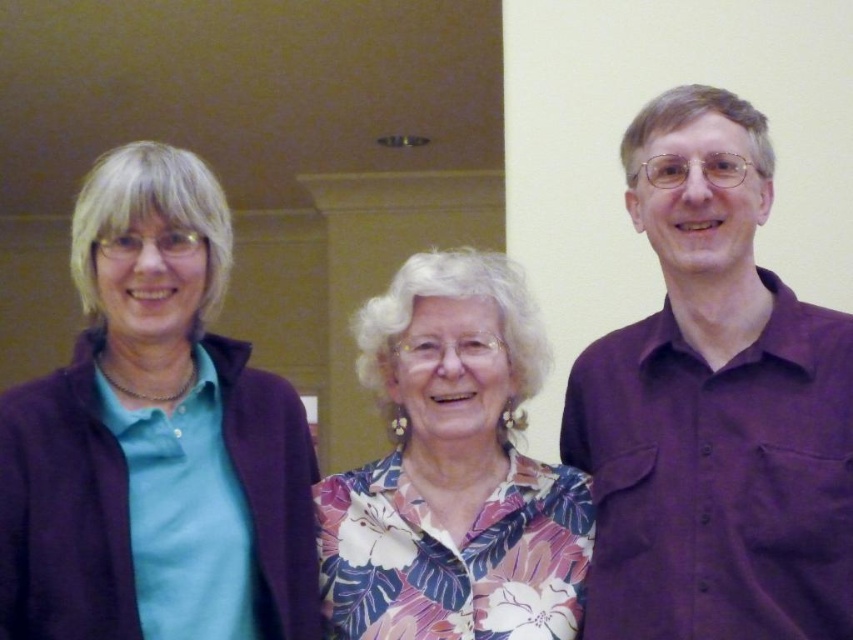
Question: Estimate the real-world distances between objects in this image. Which object is farther from the matte purple jacket at left?

Choices:
 (A) floral print blouse at center
 (B) purple cotton shirt at right

Answer: (B)

Question: Among these points, which one is farthest from the camera?

Choices:
 (A) (206, 234)
 (B) (700, 538)

Answer: (A)

Question: Does purple cotton shirt at right have a larger size compared to matte purple jacket at left?

Choices:
 (A) yes
 (B) no

Answer: (A)

Question: Which point appears closest to the camera in this image?

Choices:
 (A) (201, 484)
 (B) (339, 580)

Answer: (A)

Question: Can you confirm if matte purple jacket at left is positioned below floral print blouse at center?

Choices:
 (A) yes
 (B) no

Answer: (B)

Question: Observing the image, what is the correct spatial positioning of purple cotton shirt at right in reference to matte purple jacket at left?

Choices:
 (A) right
 (B) left

Answer: (A)